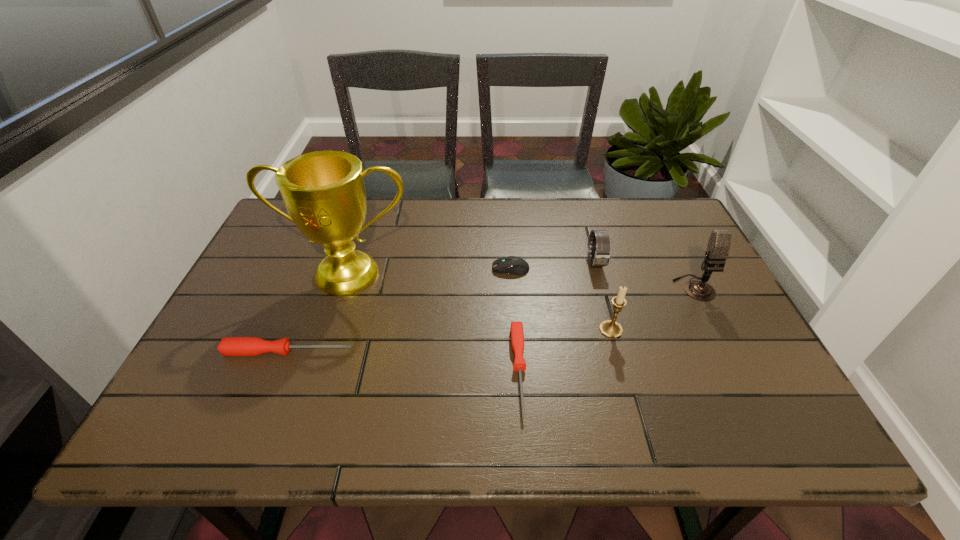
At what (x,y) coordinates should I click in order to perform the action: click on the taller screwdriver. Please return your answer as a coordinate pair (x, y). This screenshot has width=960, height=540. Looking at the image, I should click on (230, 346).

Where is `the right screwdriver`? the right screwdriver is located at coordinates (516, 331).

Locate an element on the screen. the shorter screwdriver is located at coordinates pyautogui.click(x=516, y=331).

Locate an element on the screen. The height and width of the screenshot is (540, 960). the third tallest object is located at coordinates (611, 329).

At what (x,y) coordinates should I click in order to perform the action: click on the second tallest object. Please return your answer as a coordinate pair (x, y). The width and height of the screenshot is (960, 540). Looking at the image, I should click on (719, 242).

I want to click on the rightmost object, so click(719, 242).

You are a GUI agent. You are given a task and a screenshot of the screen. Output one action in this format:
    pyautogui.click(x=<x>, y=<y>)
    Task: Click on the computer equipment
    Image resolution: width=960 pixels, height=540 pixels.
    Given the screenshot: What is the action you would take?
    pyautogui.click(x=514, y=265)

You are a GUI agent. You are given a task and a screenshot of the screen. Output one action in this format:
    pyautogui.click(x=<x>, y=<y>)
    Task: Click on the award
    Image resolution: width=960 pixels, height=540 pixels.
    Given the screenshot: What is the action you would take?
    pyautogui.click(x=324, y=192)

The image size is (960, 540). What are the coordinates of `the fourth shortest object` in the screenshot? It's located at (600, 252).

This screenshot has width=960, height=540. What are the coordinates of `vacant region located at the tip of the left screwdriver` in the screenshot? It's located at (409, 352).